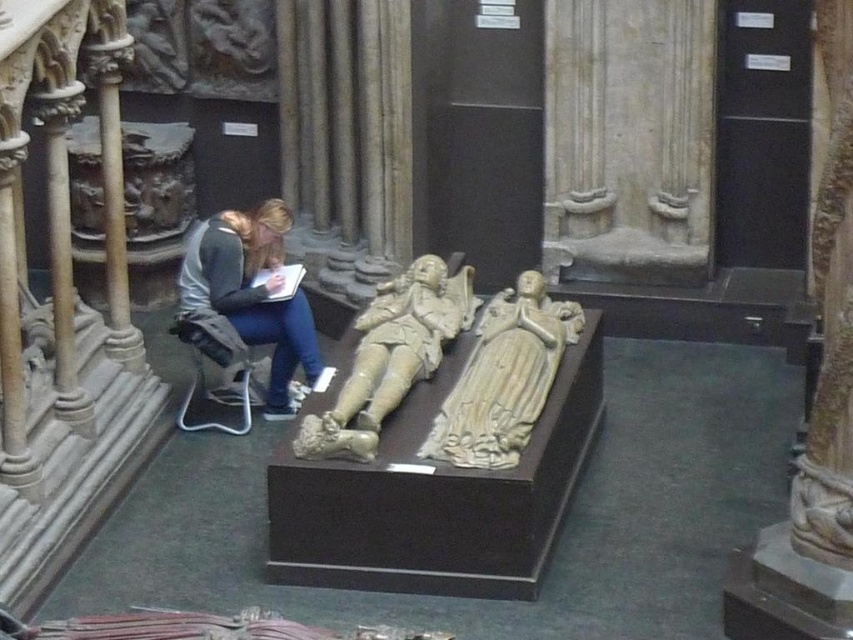
Question: Can you confirm if stone carving at center is positioned above stone statue at center?

Choices:
 (A) no
 (B) yes

Answer: (A)

Question: Estimate the real-world distances between objects in this image. Which object is farther from the denim jacket at lower left?

Choices:
 (A) stone statue at center
 (B) stone carving at center

Answer: (B)

Question: Which object is the farthest from the denim jacket at lower left?

Choices:
 (A) stone statue at center
 (B) stone carving at center

Answer: (B)

Question: Does stone carving at center lie behind denim jacket at lower left?

Choices:
 (A) yes
 (B) no

Answer: (B)

Question: Estimate the real-world distances between objects in this image. Which object is closer to the stone statue at center?

Choices:
 (A) stone carving at center
 (B) denim jacket at lower left

Answer: (A)

Question: Where is stone carving at center located in relation to denim jacket at lower left in the image?

Choices:
 (A) right
 (B) left

Answer: (A)